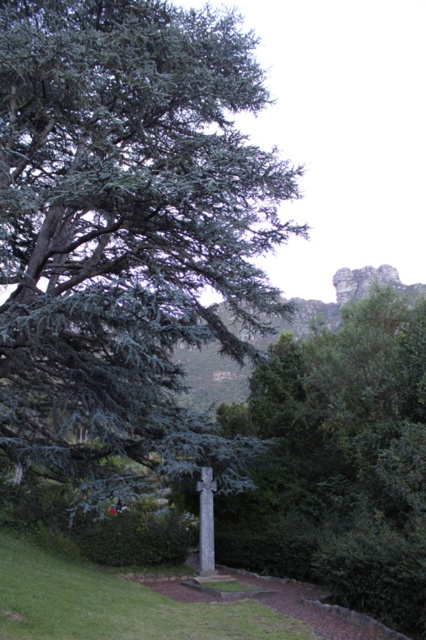
Consider the image. Does green needle-like at center have a lesser height compared to green leafy tree at center?

Incorrect, green needle-like at center's height does not fall short of green leafy tree at center's.

Can you confirm if green needle-like at center is bigger than green leafy tree at center?

Indeed, green needle-like at center has a larger size compared to green leafy tree at center.

This screenshot has height=640, width=426. What are the coordinates of `green needle-like at center` in the screenshot? It's located at (126, 232).